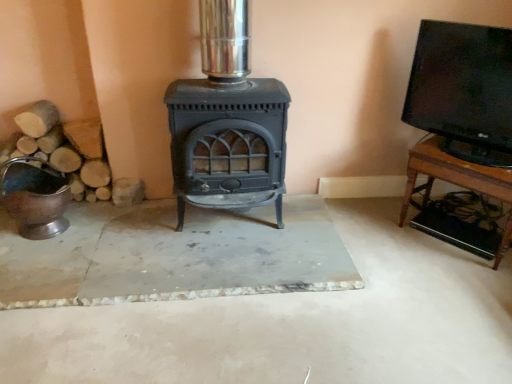
Measure the distance between point (178, 216) and camera.

The depth of point (178, 216) is 2.20 meters.

This screenshot has height=384, width=512. What do you see at coordinates (457, 180) in the screenshot?
I see `wooden tv stand at right` at bounding box center [457, 180].

The image size is (512, 384). I want to click on black glossy tv at upper right, so click(463, 90).

Image resolution: width=512 pixels, height=384 pixels. What do you see at coordinates (35, 196) in the screenshot?
I see `shiny metallic bucket at left` at bounding box center [35, 196].

At what (x,y) coordinates should I click in order to perform the action: click on matte black wood burning stove at center. Please return your answer as a coordinate pair (x, y). Looking at the image, I should click on (227, 122).

Consider the image. Is wooden tv stand at right behind matte black wood burning stove at center?

That is True.

Where is `wood burning stove located on the left of wooden tv stand at right`? This screenshot has width=512, height=384. wood burning stove located on the left of wooden tv stand at right is located at coordinates (227, 122).

Considering the sizes of objects wooden tv stand at right and matte black wood burning stove at center in the image provided, who is thinner, wooden tv stand at right or matte black wood burning stove at center?

wooden tv stand at right is thinner.

Would you say matte black wood burning stove at center is to the left or to the right of wooden tv stand at right in the picture?

matte black wood burning stove at center is positioned on wooden tv stand at right's left side.

From the image's perspective, which one is positioned lower, matte black wood burning stove at center or wooden tv stand at right?

wooden tv stand at right is shown below in the image.

Who is bigger, matte black wood burning stove at center or wooden tv stand at right?

matte black wood burning stove at center.

Between shiny metallic bucket at left and black glossy tv at upper right, which one has smaller width?

With smaller width is black glossy tv at upper right.

Is shiny metallic bucket at left positioned beyond the bounds of black glossy tv at upper right?

Yes, shiny metallic bucket at left is not within black glossy tv at upper right.

Between wooden tv stand at right and shiny metallic bucket at left, which one appears on the left side from the viewer's perspective?

shiny metallic bucket at left is more to the left.

From a real-world perspective, is wooden tv stand at right positioned above or below shiny metallic bucket at left?

In terms of real-world spatial position, wooden tv stand at right is above shiny metallic bucket at left.

Is wooden tv stand at right facing towards shiny metallic bucket at left?

No, wooden tv stand at right is not aimed at shiny metallic bucket at left.

Does matte black wood burning stove at center appear on the right side of black glossy tv at upper right?

In fact, matte black wood burning stove at center is to the left of black glossy tv at upper right.

Which point is more distant from viewer, (218, 43) or (414, 92)?

The point (414, 92) is farther.

From a real-world perspective, is matte black wood burning stove at center positioned above or below black glossy tv at upper right?

In terms of real-world spatial position, matte black wood burning stove at center is below black glossy tv at upper right.

Is matte black wood burning stove at center not within black glossy tv at upper right?

matte black wood burning stove at center lies outside black glossy tv at upper right's area.

Where is `appliance lying below the matte black wood burning stove at center (from the image's perspective)`? appliance lying below the matte black wood burning stove at center (from the image's perspective) is located at coordinates (35, 196).

In the scene shown: From a real-world perspective, is matte black wood burning stove at center beneath shiny metallic bucket at left?

No, from a real-world perspective, matte black wood burning stove at center is not below shiny metallic bucket at left.

What's the angular difference between matte black wood burning stove at center and shiny metallic bucket at left's facing directions?

The angle between the facing direction of matte black wood burning stove at center and the facing direction of shiny metallic bucket at left is 41.5 degrees.

Can you confirm if matte black wood burning stove at center is positioned to the right of shiny metallic bucket at left?

Yes, matte black wood burning stove at center is to the right of shiny metallic bucket at left.

Is point (56, 171) positioned in front of point (415, 183)?

Yes.

From the image's perspective, is shiny metallic bucket at left above wooden tv stand at right?

No, from the image's perspective, shiny metallic bucket at left is not on top of wooden tv stand at right.

Between shiny metallic bucket at left and wooden tv stand at right, which one has smaller width?

wooden tv stand at right is thinner.

Where is `furniture located underneath the matte black wood burning stove at center (from a real-world perspective)`? The width and height of the screenshot is (512, 384). furniture located underneath the matte black wood burning stove at center (from a real-world perspective) is located at coordinates click(x=457, y=180).

I want to click on wood burning stove that is in front of the wooden tv stand at right, so [227, 122].

From the picture: Considering their positions, is shiny metallic bucket at left positioned further to matte black wood burning stove at center than black glossy tv at upper right?

black glossy tv at upper right lies further to matte black wood burning stove at center than the other object.

Estimate the real-world distances between objects in this image. Which object is closer to black glossy tv at upper right, wooden tv stand at right or shiny metallic bucket at left?

wooden tv stand at right is closer to black glossy tv at upper right.

Estimate the real-world distances between objects in this image. Which object is closer to matte black wood burning stove at center, black glossy tv at upper right or shiny metallic bucket at left?

shiny metallic bucket at left is positioned closer to the anchor matte black wood burning stove at center.

Which object lies nearer to the anchor point matte black wood burning stove at center, shiny metallic bucket at left or wooden tv stand at right?

shiny metallic bucket at left is positioned closer to the anchor matte black wood burning stove at center.

From the image, which object appears to be nearer to shiny metallic bucket at left, black glossy tv at upper right or wooden tv stand at right?

The object closer to shiny metallic bucket at left is wooden tv stand at right.

When comparing their distances from shiny metallic bucket at left, does black glossy tv at upper right or matte black wood burning stove at center seem closer?

matte black wood burning stove at center is closer to shiny metallic bucket at left.

Based on their spatial positions, is shiny metallic bucket at left or black glossy tv at upper right closer to wooden tv stand at right?

black glossy tv at upper right.

Considering their positions, is wooden tv stand at right positioned further to shiny metallic bucket at left than matte black wood burning stove at center?

wooden tv stand at right.

Identify the location of wood burning stove located between shiny metallic bucket at left and wooden tv stand at right in the left-right direction. The image size is (512, 384). (227, 122).

Where is `wide between shiny metallic bucket at left and wooden tv stand at right`? The height and width of the screenshot is (384, 512). wide between shiny metallic bucket at left and wooden tv stand at right is located at coordinates (463, 90).

You are a GUI agent. You are given a task and a screenshot of the screen. Output one action in this format:
    pyautogui.click(x=<x>, y=<y>)
    Task: Click on the wide between matte black wood burning stove at center and wooden tv stand at right in the horizontal direction
    This screenshot has width=512, height=384.
    Given the screenshot: What is the action you would take?
    pyautogui.click(x=463, y=90)

The height and width of the screenshot is (384, 512). What are the coordinates of `wood burning stove between shiny metallic bucket at left and black glossy tv at upper right from left to right` in the screenshot? It's located at (227, 122).